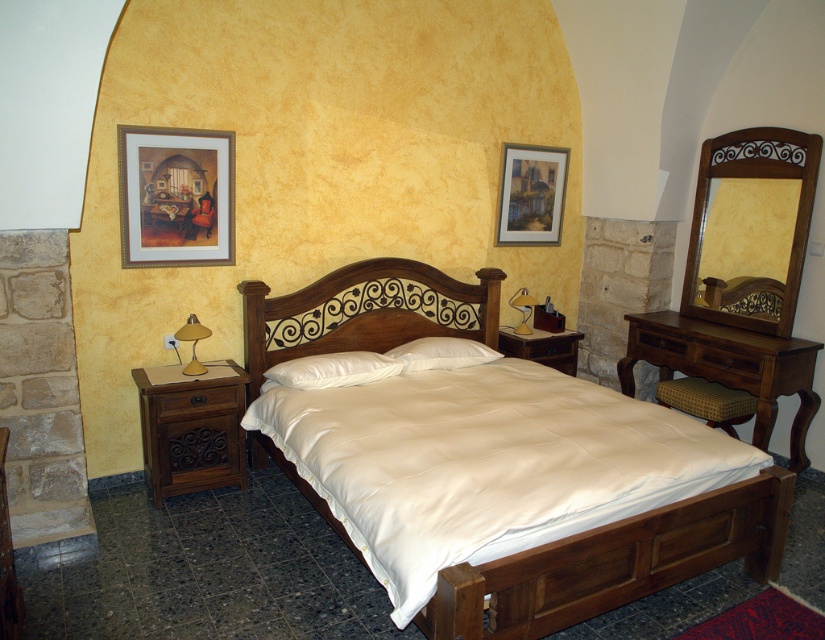
Is mahogany wood dresser at right taller than white soft pillow at center?

Indeed, mahogany wood dresser at right has a greater height compared to white soft pillow at center.

How far apart are mahogany wood dresser at right and white soft pillow at center?

mahogany wood dresser at right and white soft pillow at center are 4.40 feet apart.

Identify the location of mahogany wood dresser at right. The width and height of the screenshot is (825, 640). (729, 365).

Locate an element on the screen. This screenshot has height=640, width=825. wooden picture frame at upper center is located at coordinates (531, 195).

Can you confirm if wooden picture frame at upper center is smaller than yellow-green fabric ottoman at lower right?

Actually, wooden picture frame at upper center might be larger than yellow-green fabric ottoman at lower right.

Does point (536, 172) come behind point (713, 426)?

Yes, point (536, 172) is behind point (713, 426).

At what (x,y) coordinates should I click in order to perform the action: click on wooden picture frame at upper center. Please return your answer as a coordinate pair (x, y). Looking at the image, I should click on (531, 195).

Does wooden carved headboard at center appear over brown wooden dresser at center?

Correct, wooden carved headboard at center is located above brown wooden dresser at center.

Between wooden carved headboard at center and brown wooden dresser at center, which one has more height?

wooden carved headboard at center is taller.

This screenshot has width=825, height=640. I want to click on wooden carved headboard at center, so 366,310.

At what (x,y) coordinates should I click in order to perform the action: click on wooden carved headboard at center. Please return your answer as a coordinate pair (x, y). Looking at the image, I should click on (366, 310).